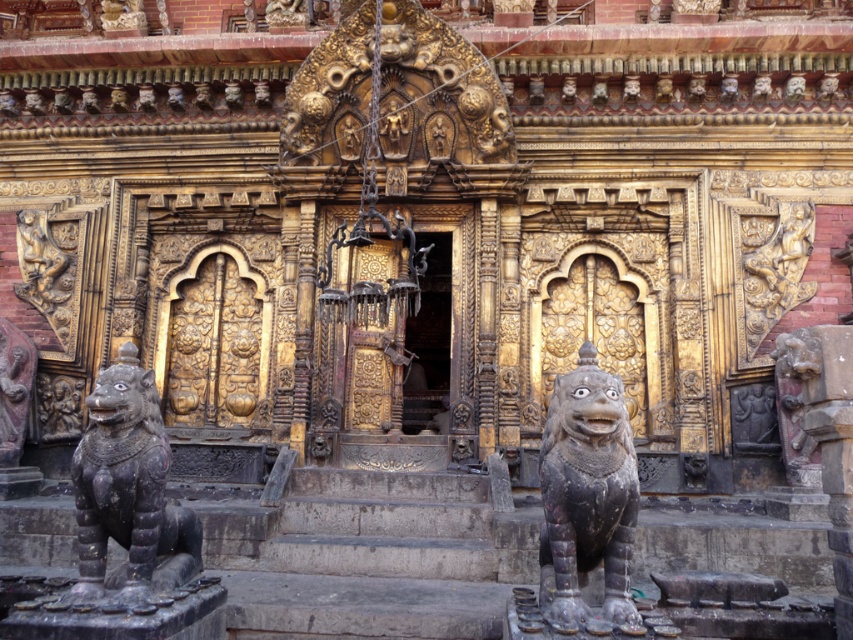
You are a visitor standing at the entrance of the temple. You notice two stone lions. One is the dark gray stone lion at center and the other is the black stone lion at lower left. Which lion do you think is bigger?

The dark gray stone lion at center is larger in size than the black stone lion at lower left, so the dark gray stone lion at center is bigger.

You are standing in front of the temple entrance and want to take a photo of the dark gray stone lion at center and the black stone lion at lower left. Which lion will appear closer to the camera in your photo?

The dark gray stone lion at center will appear closer to the camera because it is positioned in front of the black stone lion at lower left.